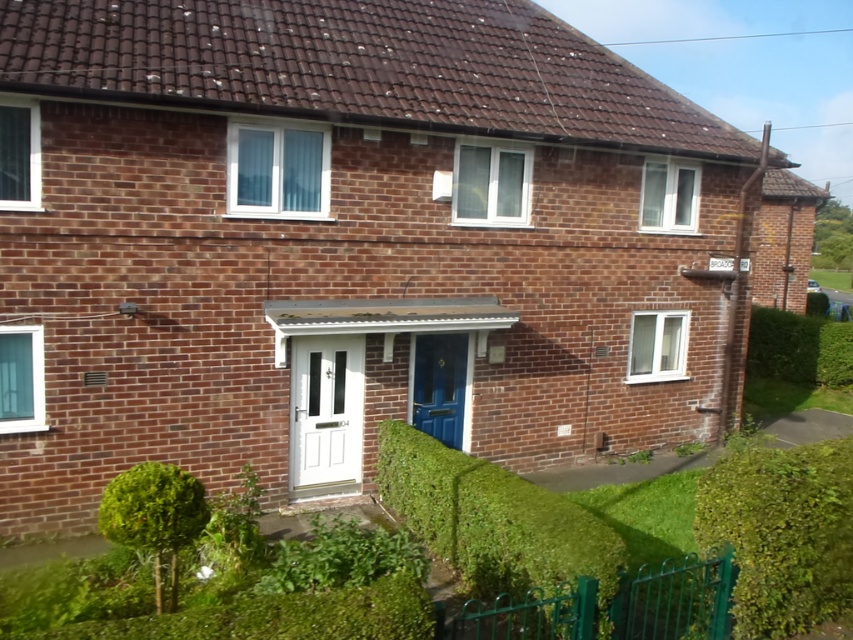
Question: Which point is farther to the camera?

Choices:
 (A) green leafy hedge at lower right
 (B) green leafy hedge at right
 (C) green leafy hedge at lower center
 (D) green leafy hedge at lower left

Answer: (B)

Question: Which point is closer to the camera?

Choices:
 (A) (776, 330)
 (B) (175, 486)
 (C) (709, 474)
 (D) (625, 552)

Answer: (D)

Question: Does green leafy hedge at lower center appear over green leafy hedge at right?

Choices:
 (A) no
 (B) yes

Answer: (A)

Question: Among these objects, which one is nearest to the camera?

Choices:
 (A) green leafy hedge at right
 (B) green leafy hedge at lower center
 (C) green leafy hedge at lower right
 (D) green leafy hedge at lower left

Answer: (B)

Question: Can you confirm if green leafy hedge at lower right is wider than green leafy hedge at right?

Choices:
 (A) no
 (B) yes

Answer: (A)

Question: Is green leafy hedge at lower right wider than green leafy hedge at lower left?

Choices:
 (A) no
 (B) yes

Answer: (B)